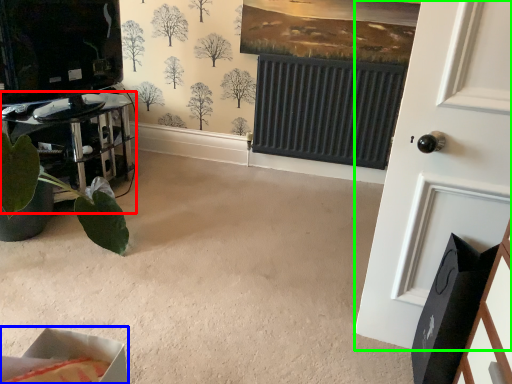
Question: Based on their relative distances, which object is farther from furniture (highlighted by a red box)? Choose from cardboard box (highlighted by a blue box) and door (highlighted by a green box).

Choices:
 (A) cardboard box
 (B) door

Answer: (A)